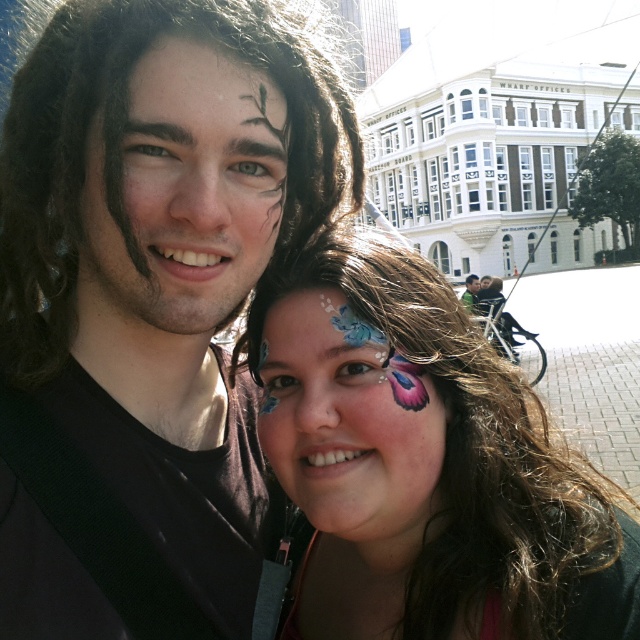
Question: Estimate the real-world distances between objects in this image. Which object is closer to the matte black shirt at center?

Choices:
 (A) matte black hair at center
 (B) matte butterfly face paint at center
 (C) matte face paint butterfly at center
 (D) matte black face paint at upper left

Answer: (C)

Question: Which object appears farthest from the camera in this image?

Choices:
 (A) matte black face paint at upper left
 (B) matte black hair at center
 (C) matte black shirt at center

Answer: (C)

Question: Can you confirm if matte black hair at center is positioned above matte black face paint at upper left?

Choices:
 (A) no
 (B) yes

Answer: (A)

Question: Is matte black hair at center closer to the viewer compared to matte black face paint at upper left?

Choices:
 (A) no
 (B) yes

Answer: (B)

Question: Which point is closer to the camera?

Choices:
 (A) (433, 333)
 (B) (392, 372)
 (C) (106, 214)

Answer: (C)

Question: Does matte black hair at center have a smaller size compared to matte butterfly face paint at center?

Choices:
 (A) yes
 (B) no

Answer: (B)